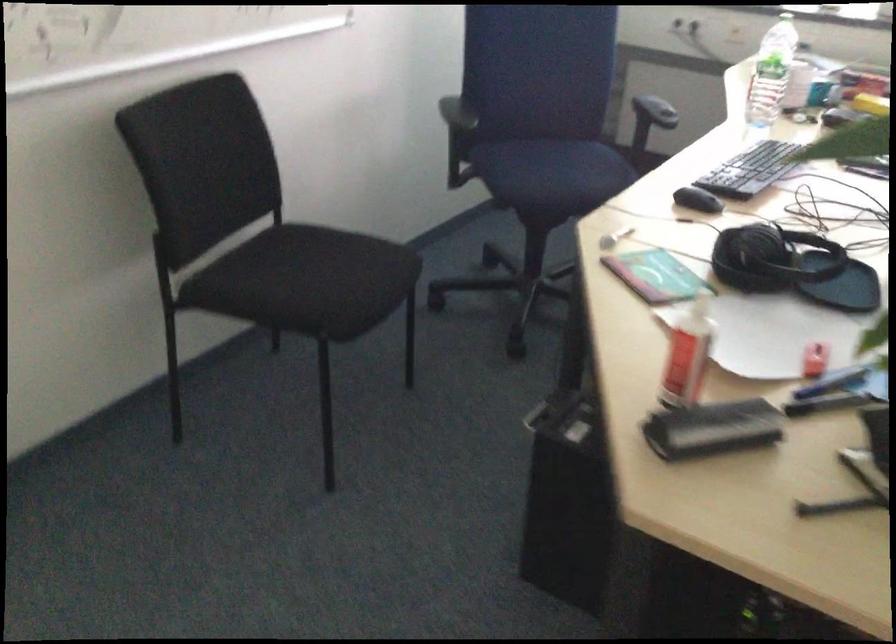
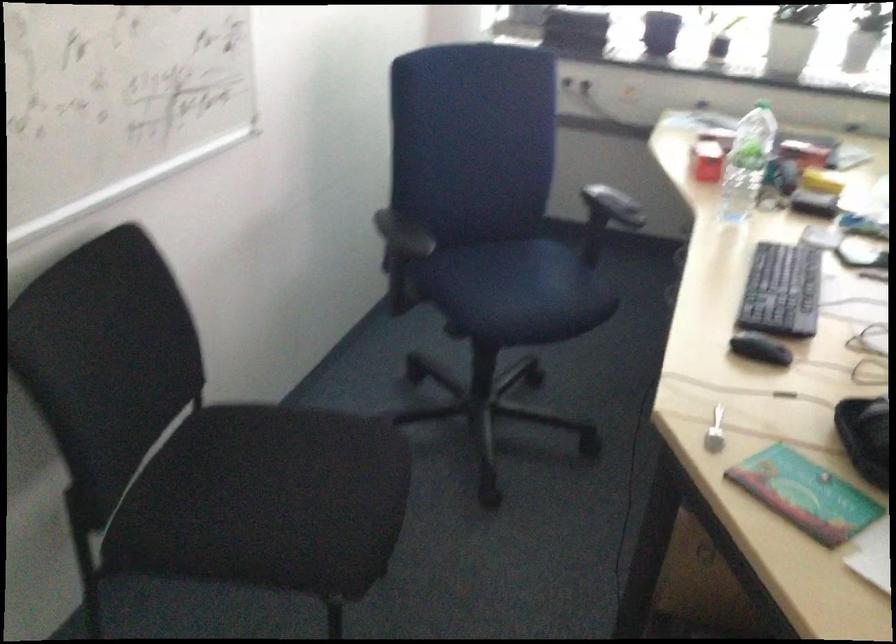
Which direction would the cameraman need to move to produce the second image?

The cameraman moved toward left, forward.